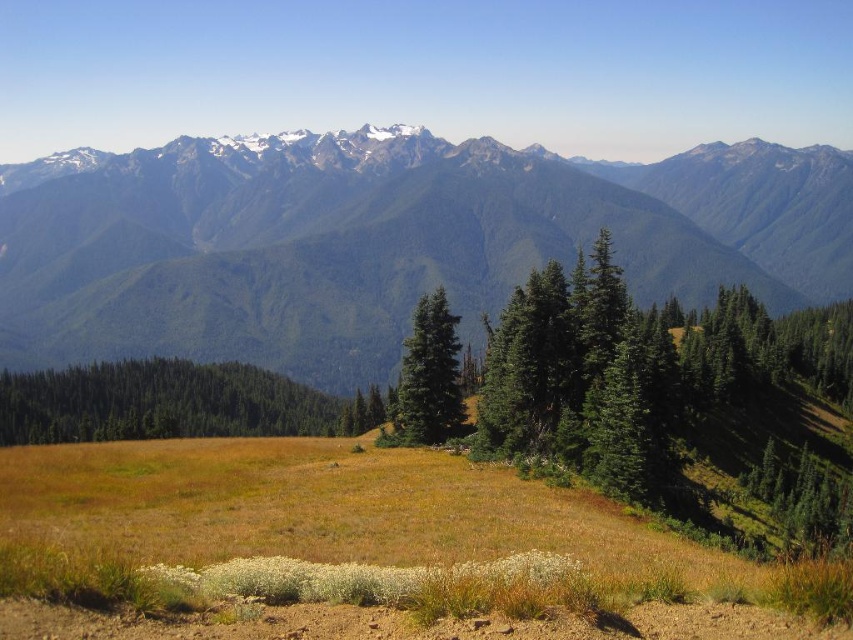
Question: Which point is farther from the camera taking this photo?

Choices:
 (A) (70, 342)
 (B) (450, 422)

Answer: (A)

Question: Estimate the real-world distances between objects in this image. Which object is closer to the green matte tree at left?

Choices:
 (A) green forested mountain range at upper center
 (B) green matte tree at center

Answer: (B)

Question: Does green forested mountain range at upper center appear under green matte tree at left?

Choices:
 (A) yes
 (B) no

Answer: (B)

Question: Which point is farther to the camera?

Choices:
 (A) (59, 176)
 (B) (187, 390)

Answer: (A)

Question: Is green forested mountain range at upper center wider than green matte tree at center?

Choices:
 (A) no
 (B) yes

Answer: (B)

Question: Is green forested mountain range at upper center further to camera compared to green matte tree at left?

Choices:
 (A) yes
 (B) no

Answer: (A)